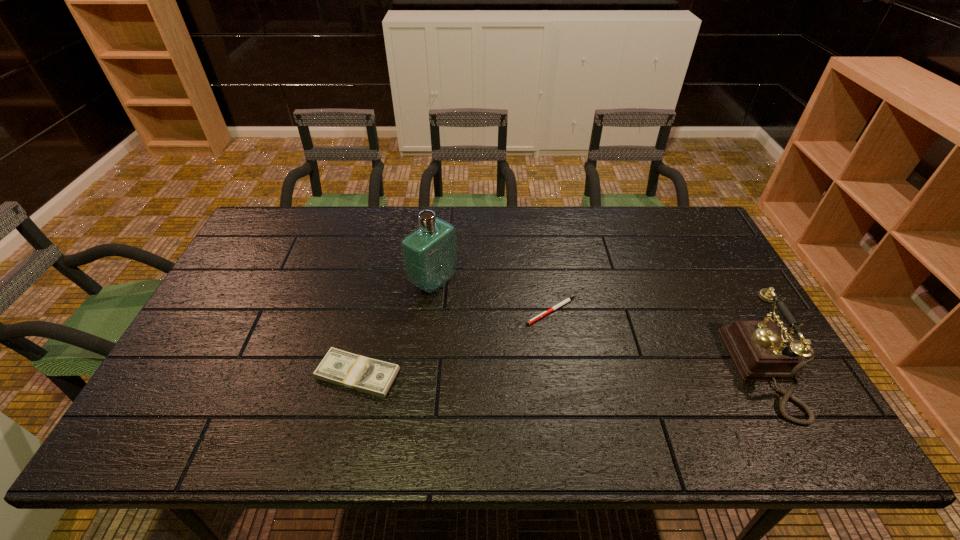
You are a GUI agent. You are given a task and a screenshot of the screen. Output one action in this format:
    pyautogui.click(x=<x>, y=<y>)
    Task: Click on the free space at the right edge
    
    Given the screenshot: What is the action you would take?
    pyautogui.click(x=699, y=263)

This screenshot has height=540, width=960. Find the location of `free region at the near left corner of the desktop`. free region at the near left corner of the desktop is located at coordinates (156, 400).

This screenshot has width=960, height=540. I want to click on free space between the tallest object and the third object from left to right, so click(x=492, y=296).

Where is `unoccupied position between the second shortest object and the perfume`? The image size is (960, 540). unoccupied position between the second shortest object and the perfume is located at coordinates (396, 328).

Find the location of `empty location between the dollar and the rightmost object`. empty location between the dollar and the rightmost object is located at coordinates (566, 372).

I want to click on vacant space that is in between the tallest object and the dollar, so click(x=396, y=328).

Where is `free spot between the pen and the perfume`? This screenshot has width=960, height=540. free spot between the pen and the perfume is located at coordinates (492, 296).

Where is `free space between the second object from right to left and the third shortest object`? The width and height of the screenshot is (960, 540). free space between the second object from right to left and the third shortest object is located at coordinates (663, 341).

I want to click on empty space between the third shortest object and the dollar, so click(566, 372).

Where is `free space that is in between the shortest object and the second tallest object`? free space that is in between the shortest object and the second tallest object is located at coordinates (663, 341).